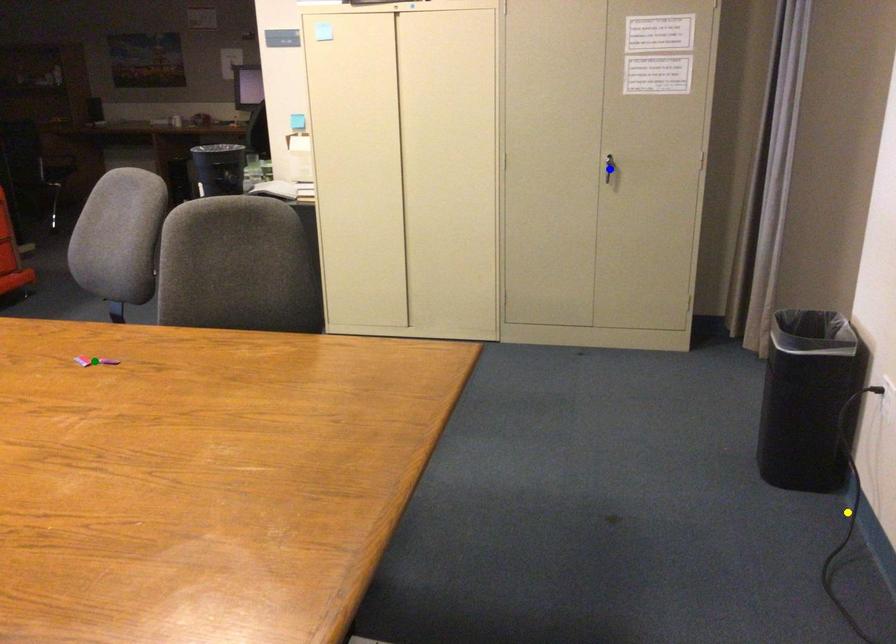
Order these from nearest to farthest:
- green point
- yellow point
- blue point

1. blue point
2. yellow point
3. green point